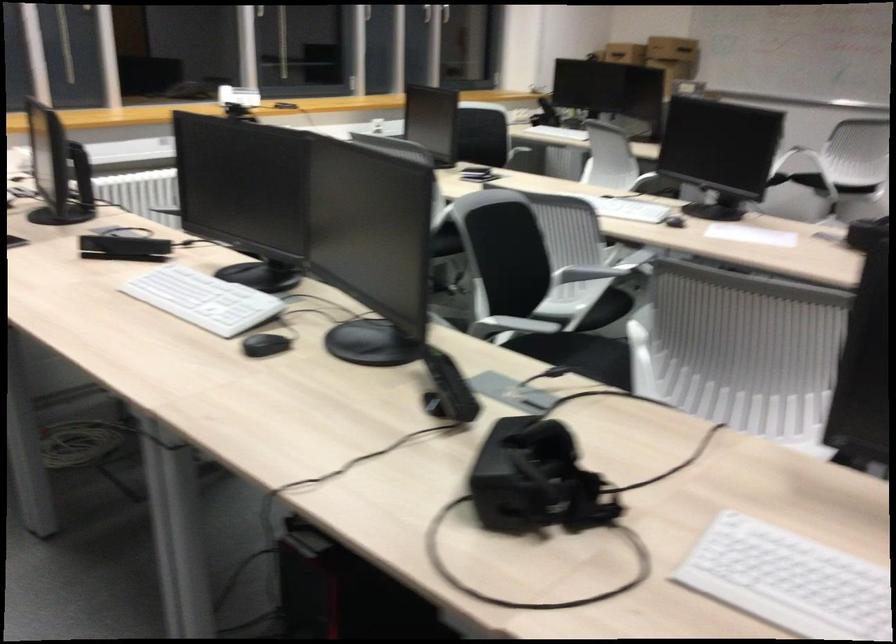
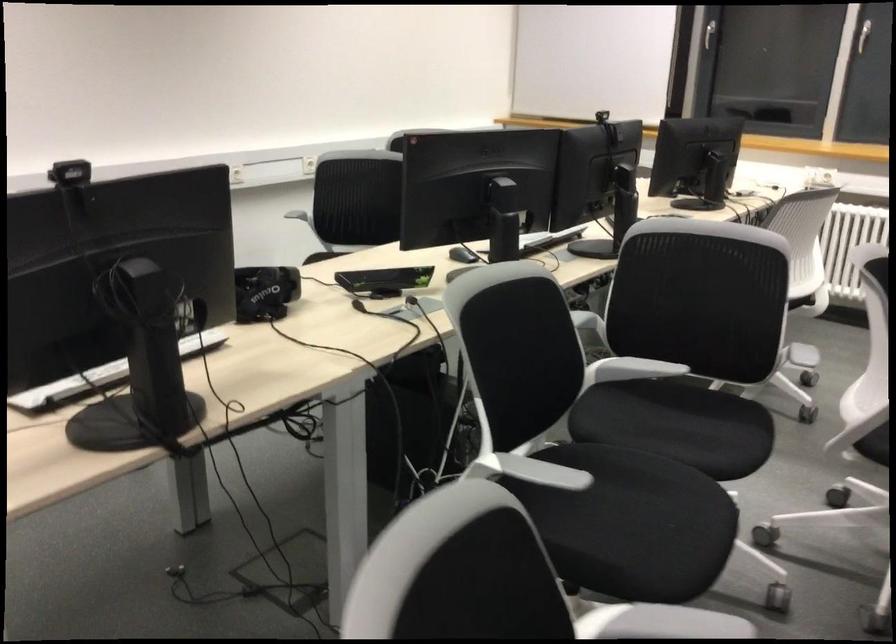
Question: I am providing you with two images of the same scene from different viewpoints. Please identify which objects are invisible in image2.

Choices:
 (A) white dispenser actuator
 (B) black VR headset
 (C) black webcam
 (D) black sensor bar

Answer: (D)